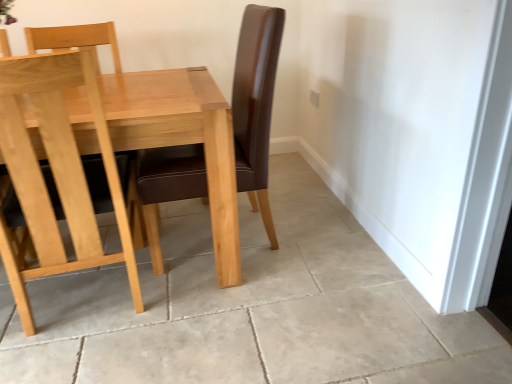
Identify the location of spots to the right of light brown wood chair at left. The image size is (512, 384). [x=206, y=325].